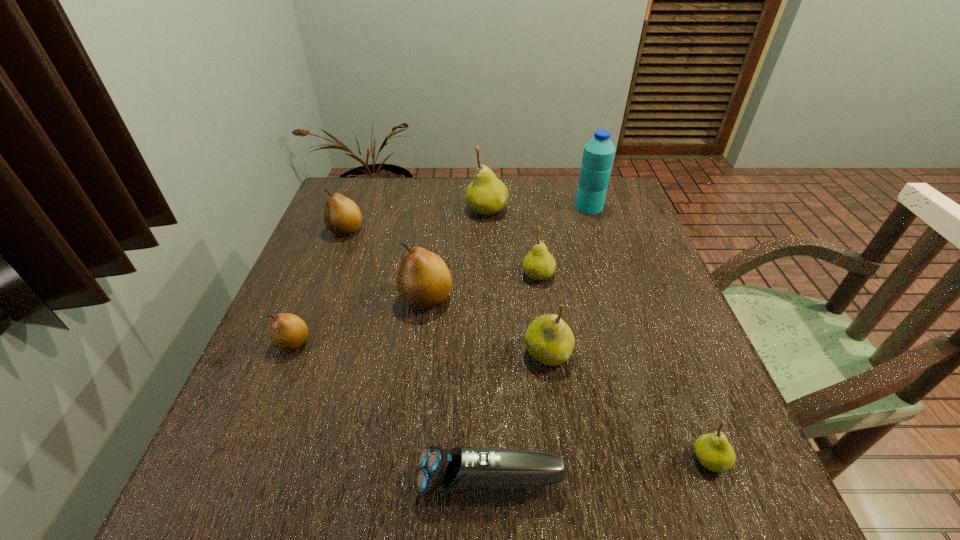
In order to click on the rightmost green pear in this screenshot , I will do `click(714, 452)`.

Locate an element on the screen. electric shaver is located at coordinates (462, 468).

You are a GUI agent. You are given a task and a screenshot of the screen. Output one action in this format:
    pyautogui.click(x=<x>, y=<y>)
    Task: Click on the vacant region located on the right of the water bottle
    The height and width of the screenshot is (540, 960).
    Given the screenshot: What is the action you would take?
    pyautogui.click(x=620, y=206)

Identify the location of free space located 0.180m on the right of the farthest green pear. The image size is (960, 540). (569, 210).

This screenshot has height=540, width=960. In order to click on vacant space located on the back of the biggest brown pear in this screenshot , I will do click(x=434, y=236).

I want to click on free space located 0.100m on the right of the third smallest green pear, so (620, 353).

Locate an element on the screen. This screenshot has height=540, width=960. free space located 0.330m on the right of the second biggest brown pear is located at coordinates (483, 230).

Identify the location of vacant space located on the right of the second smallest green pear. The height and width of the screenshot is (540, 960). click(x=632, y=275).

At what (x,y) coordinates should I click in order to perform the action: click on free location located on the front of the nearest brown pear. Please return your answer as a coordinate pair (x, y). Image resolution: width=960 pixels, height=540 pixels. Looking at the image, I should click on (232, 494).

Where is `free point located 0.380m on the left of the nearest green pear`? The height and width of the screenshot is (540, 960). free point located 0.380m on the left of the nearest green pear is located at coordinates (466, 460).